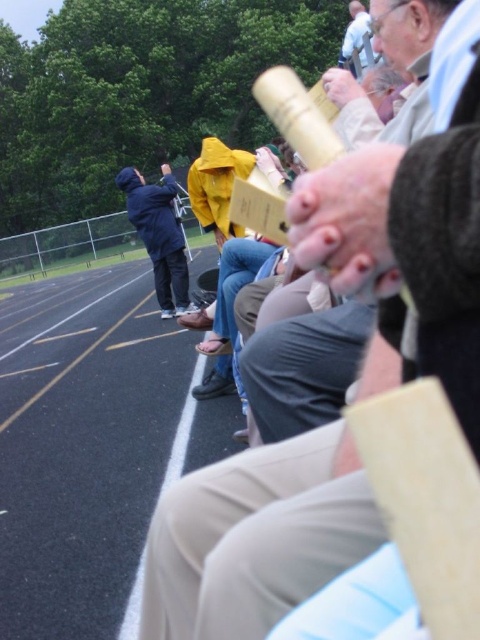
You are a spectator at the track meet and want to get a better view of the runners. You notice a wooden telescope at center and a blue matte jacket at center. Which object is closer to you?

The wooden telescope at center is closer to you because it is in front of the blue matte jacket at center.

You are a photographer standing at the edge of the track, and you want to take a photo of both the blue matte jacket at center and the light blue shirt at upper center. Which one should you focus on first if you want to capture both in the same frame without moving the camera?

The blue matte jacket at center is positioned under the light blue shirt at upper center, so you should focus on the light blue shirt at upper center first to ensure both are in focus since it is closer to the camera.

You are a spectator at the track meet and want to observe the runners clearly. You have a wooden telescope at center and a blue matte jacket at center. Which object should you use to see the runners more clearly?

The wooden telescope at center is larger in size than the blue matte jacket at center, so you should use the wooden telescope at center to see the runners more clearly.